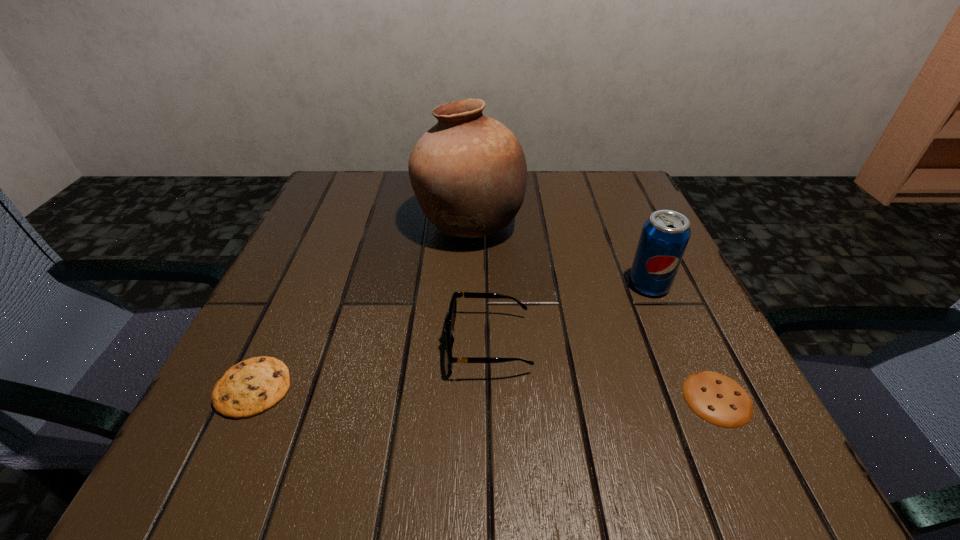
Locate an element on the screen. vacant area in the image that satisfies the following two spatial constraints: 1. on the back side of the shorter cookie; 2. on the front-facing side of the sunglasses is located at coordinates (691, 344).

Where is `vacant area in the image that satisfies the following two spatial constraints: 1. on the front side of the right cookie; 2. on the right side of the left cookie`? The width and height of the screenshot is (960, 540). vacant area in the image that satisfies the following two spatial constraints: 1. on the front side of the right cookie; 2. on the right side of the left cookie is located at coordinates (250, 398).